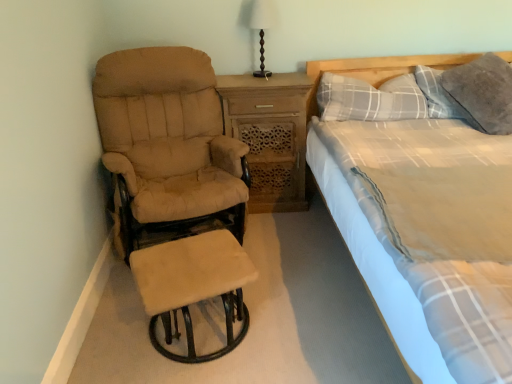
Question: Is gray plaid pillow at upper right, marked as the 1th pillow in a left-to-right arrangement, facing away from gray soft pillow at upper right, the 2th pillow viewed from the left?

Choices:
 (A) no
 (B) yes

Answer: (A)

Question: Does gray plaid pillow at upper right, the 2th pillow viewed from the right, contain gray soft pillow at upper right, marked as the first pillow in a right-to-left arrangement?

Choices:
 (A) yes
 (B) no

Answer: (B)

Question: Can you confirm if gray plaid pillow at upper right, the 2th pillow viewed from the right, is wider than gray soft pillow at upper right, the 2th pillow viewed from the left?

Choices:
 (A) yes
 (B) no

Answer: (A)

Question: Is gray plaid pillow at upper right, marked as the 1th pillow in a left-to-right arrangement, touching gray soft pillow at upper right, the 2th pillow viewed from the left?

Choices:
 (A) yes
 (B) no

Answer: (B)

Question: From the image's perspective, is gray plaid pillow at upper right, marked as the 1th pillow in a left-to-right arrangement, located beneath gray soft pillow at upper right, the 2th pillow viewed from the left?

Choices:
 (A) yes
 (B) no

Answer: (A)

Question: Is gray plaid pillow at upper right, the 2th pillow viewed from the right, at the left side of gray soft pillow at upper right, the 2th pillow viewed from the left?

Choices:
 (A) yes
 (B) no

Answer: (A)

Question: Does wooden nightstand at center have a smaller size compared to beige fabric recliner at left?

Choices:
 (A) no
 (B) yes

Answer: (B)

Question: Can you confirm if wooden nightstand at center is bigger than beige fabric recliner at left?

Choices:
 (A) yes
 (B) no

Answer: (B)

Question: From the image's perspective, is wooden nightstand at center beneath beige fabric recliner at left?

Choices:
 (A) yes
 (B) no

Answer: (B)

Question: Does wooden nightstand at center appear on the right side of beige fabric recliner at left?

Choices:
 (A) yes
 (B) no

Answer: (A)

Question: Does wooden nightstand at center lie in front of beige fabric recliner at left?

Choices:
 (A) no
 (B) yes

Answer: (A)

Question: Does wooden nightstand at center contain beige fabric recliner at left?

Choices:
 (A) yes
 (B) no

Answer: (B)

Question: Considering the relative sizes of matte brown wooden lamp at upper center and beige fabric recliner at left in the image provided, is matte brown wooden lamp at upper center wider than beige fabric recliner at left?

Choices:
 (A) no
 (B) yes

Answer: (A)